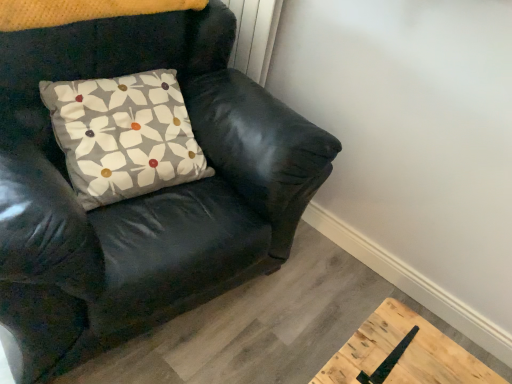
Question: Considering the relative positions of black leather chair at upper left and floral-patterned fabric pillow at upper left in the image provided, is black leather chair at upper left to the right of floral-patterned fabric pillow at upper left from the viewer's perspective?

Choices:
 (A) no
 (B) yes

Answer: (A)

Question: Is black leather chair at upper left thinner than floral-patterned fabric pillow at upper left?

Choices:
 (A) no
 (B) yes

Answer: (A)

Question: Can you confirm if black leather chair at upper left is shorter than floral-patterned fabric pillow at upper left?

Choices:
 (A) yes
 (B) no

Answer: (B)

Question: Is black leather chair at upper left at the left side of floral-patterned fabric pillow at upper left?

Choices:
 (A) yes
 (B) no

Answer: (A)

Question: Can we say black leather chair at upper left lies outside floral-patterned fabric pillow at upper left?

Choices:
 (A) no
 (B) yes

Answer: (B)

Question: Can you confirm if black leather chair at upper left is wider than floral-patterned fabric pillow at upper left?

Choices:
 (A) no
 (B) yes

Answer: (B)

Question: Can we say floral-patterned fabric pillow at upper left lies outside black leather chair at upper left?

Choices:
 (A) no
 (B) yes

Answer: (A)

Question: From the image's perspective, is floral-patterned fabric pillow at upper left on black leather chair at upper left?

Choices:
 (A) no
 (B) yes

Answer: (B)

Question: Does floral-patterned fabric pillow at upper left turn towards black leather chair at upper left?

Choices:
 (A) no
 (B) yes

Answer: (B)

Question: Does floral-patterned fabric pillow at upper left have a greater width compared to black leather chair at upper left?

Choices:
 (A) yes
 (B) no

Answer: (B)

Question: Does floral-patterned fabric pillow at upper left have a larger size compared to black leather chair at upper left?

Choices:
 (A) no
 (B) yes

Answer: (A)

Question: Is floral-patterned fabric pillow at upper left looking in the opposite direction of black leather chair at upper left?

Choices:
 (A) no
 (B) yes

Answer: (B)

Question: Is point (53, 208) positioned closer to the camera than point (141, 187)?

Choices:
 (A) farther
 (B) closer

Answer: (B)